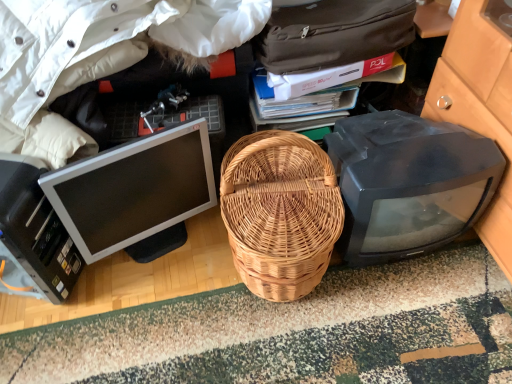
Find the location of a particular element. The image size is (512, 384). vacant region in front of white glossy computer monitor at left, the 1th computer monitor when ordered from left to right is located at coordinates (148, 314).